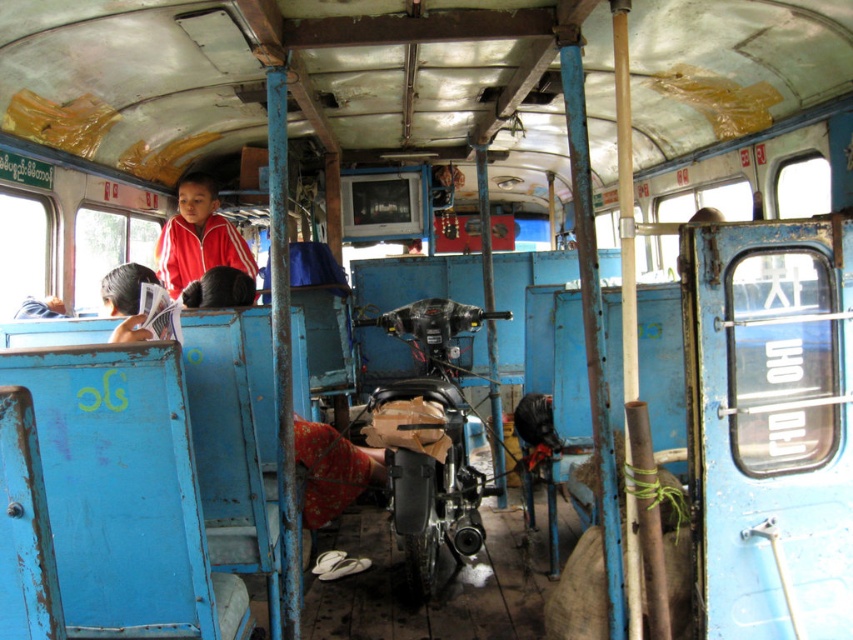
Who is more forward, [440,312] or [202,291]?

Point [202,291]

Which is above, matte black motorcycle at center or dark blue fabric jacket at upper left?

dark blue fabric jacket at upper left is above.

Who is more forward, (x=372, y=428) or (x=219, y=266)?

Point (x=372, y=428)

The height and width of the screenshot is (640, 853). Identify the location of matte black motorcycle at center. (428, 436).

Looking at this image, who is positioned more to the right, matte black motorcycle at center or red matte jacket at upper left?

matte black motorcycle at center is more to the right.

Is matte black motorcycle at center taller than red matte jacket at upper left?

Yes.

Does point (393, 525) come farther from viewer compared to point (183, 225)?

No, (393, 525) is closer to viewer.

Find the location of a particular element. This screenshot has width=853, height=640. matte black motorcycle at center is located at coordinates (428, 436).

What are the coordinates of `matte black motorcycle at center` in the screenshot? It's located at (428, 436).

Which of these two, matte black motorcycle at center or black hair at upper left, stands shorter?

black hair at upper left is shorter.

Is point (409, 481) positioned after point (128, 308)?

Yes, it is behind point (128, 308).

At what (x,y) coordinates should I click in order to perform the action: click on matte black motorcycle at center. Please return your answer as a coordinate pair (x, y). The height and width of the screenshot is (640, 853). Looking at the image, I should click on (428, 436).